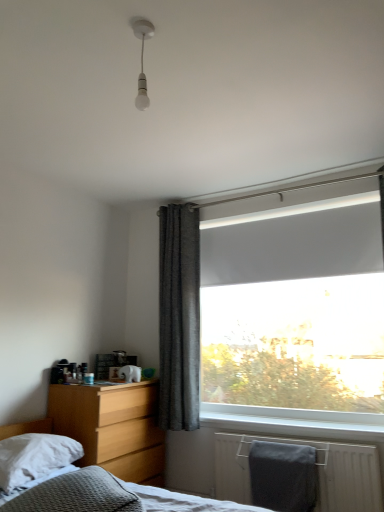
Question: Would you say dark grey textured curtain at center is outside gray matte towel at lower right?

Choices:
 (A) yes
 (B) no

Answer: (A)

Question: Is dark grey textured curtain at center aimed at gray matte towel at lower right?

Choices:
 (A) yes
 (B) no

Answer: (B)

Question: From a real-world perspective, is dark grey textured curtain at center under gray matte towel at lower right?

Choices:
 (A) no
 (B) yes

Answer: (A)

Question: From the image's perspective, is dark grey textured curtain at center located beneath gray matte towel at lower right?

Choices:
 (A) no
 (B) yes

Answer: (A)

Question: Are dark grey textured curtain at center and gray matte towel at lower right beside each other?

Choices:
 (A) yes
 (B) no

Answer: (B)

Question: Does dark grey textured curtain at center have a larger size compared to gray matte towel at lower right?

Choices:
 (A) no
 (B) yes

Answer: (B)

Question: Is the depth of white glossy bulb at upper center less than that of light wood/finish nightstand at lower left?

Choices:
 (A) no
 (B) yes

Answer: (B)

Question: Would you say white glossy bulb at upper center is a long distance from light wood/finish nightstand at lower left?

Choices:
 (A) no
 (B) yes

Answer: (B)

Question: Does white glossy bulb at upper center appear on the right side of light wood/finish nightstand at lower left?

Choices:
 (A) yes
 (B) no

Answer: (A)

Question: From a real-world perspective, is white glossy bulb at upper center over light wood/finish nightstand at lower left?

Choices:
 (A) no
 (B) yes

Answer: (B)

Question: From a real-world perspective, is white glossy bulb at upper center below light wood/finish nightstand at lower left?

Choices:
 (A) yes
 (B) no

Answer: (B)

Question: Considering the relative sizes of white glossy bulb at upper center and light wood/finish nightstand at lower left in the image provided, is white glossy bulb at upper center bigger than light wood/finish nightstand at lower left?

Choices:
 (A) no
 (B) yes

Answer: (A)

Question: Does light wood/finish nightstand at lower left turn towards dark grey textured curtain at center?

Choices:
 (A) no
 (B) yes

Answer: (A)